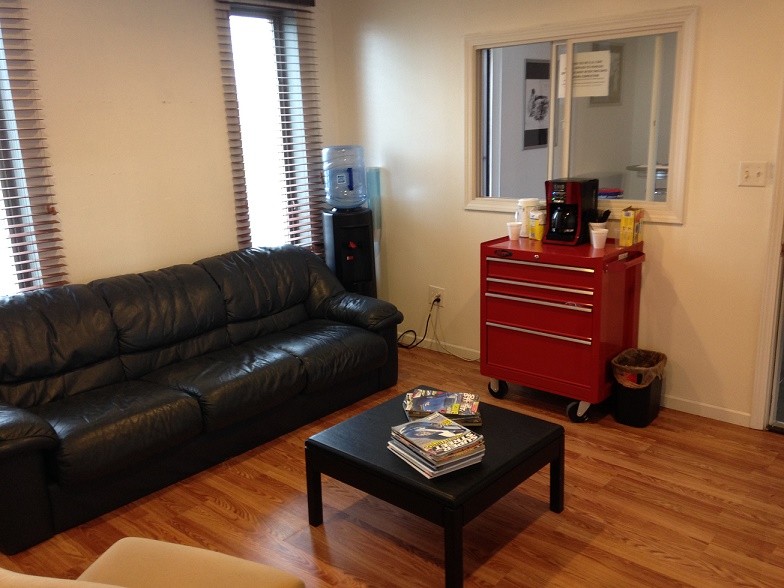
Locate an element on the screen. The image size is (784, 588). sofa is located at coordinates (218, 383).